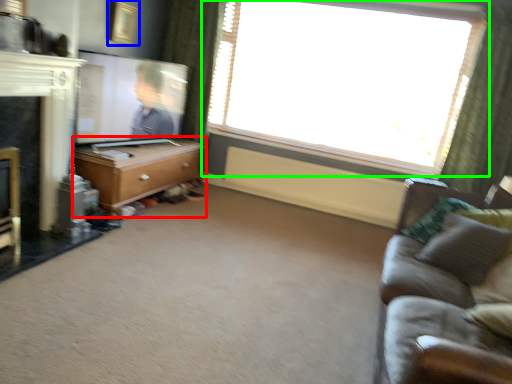
Question: Estimate the real-world distances between objects in this image. Which object is closer to chest of drawers (highlighted by a red box), picture frame (highlighted by a blue box) or window (highlighted by a green box)?

Choices:
 (A) picture frame
 (B) window

Answer: (A)